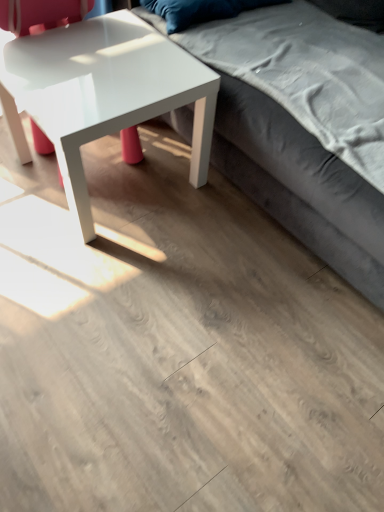
The width and height of the screenshot is (384, 512). I want to click on vacant space in glossy white coffee table at left (from a real-world perspective), so click(125, 187).